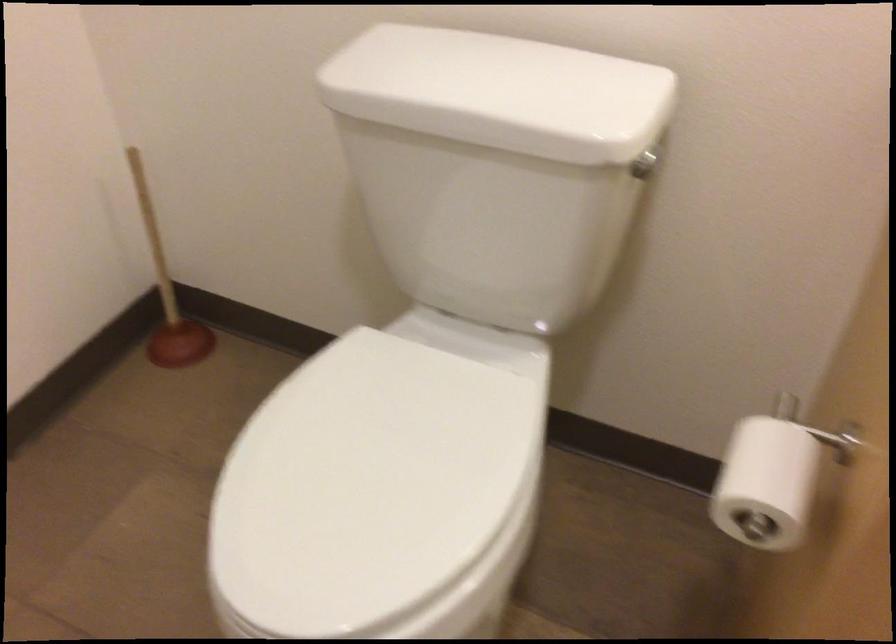
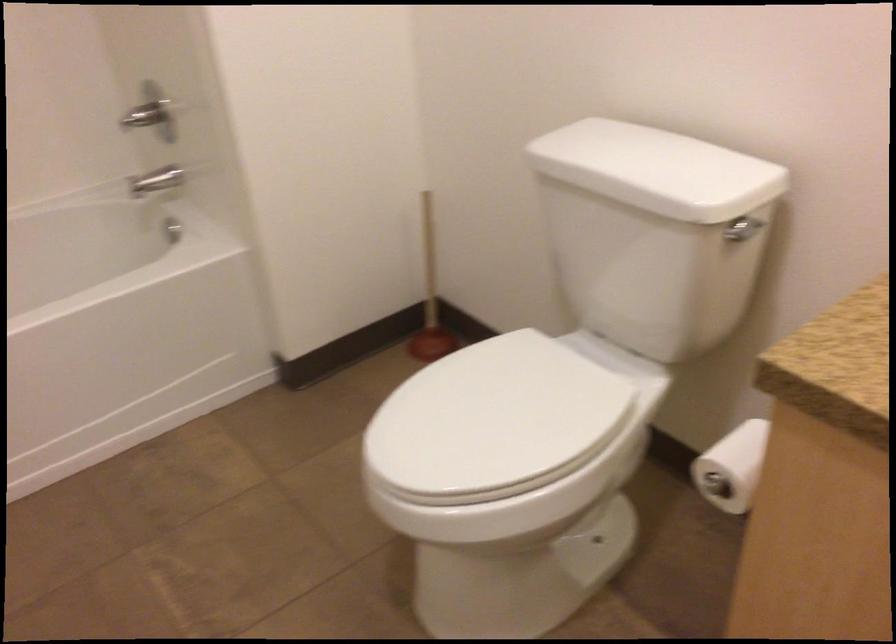
Question: The first image is from the beginning of the video and the second image is from the end. How did the camera likely rotate when shooting the video?

Choices:
 (A) Left
 (B) Right
 (C) Up
 (D) Down

Answer: (A)